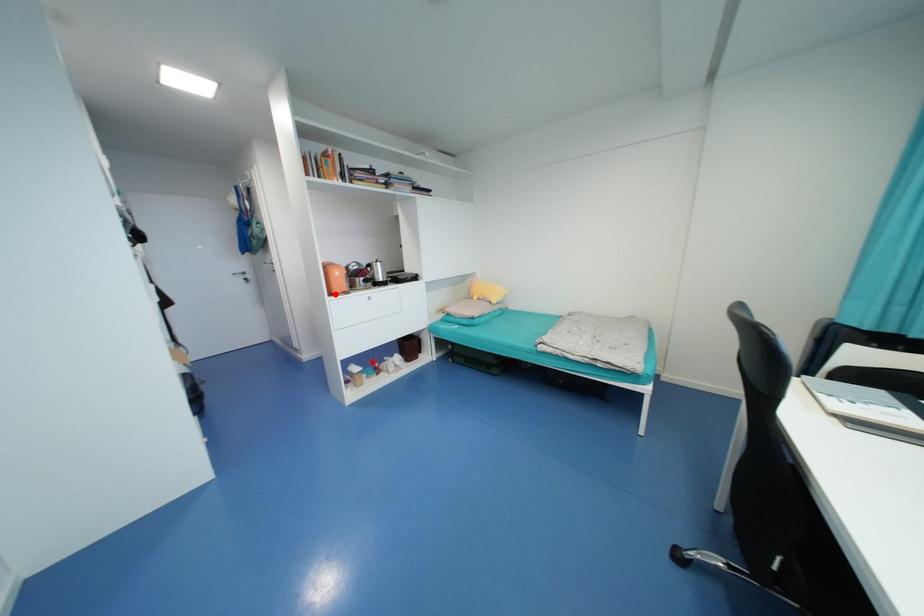
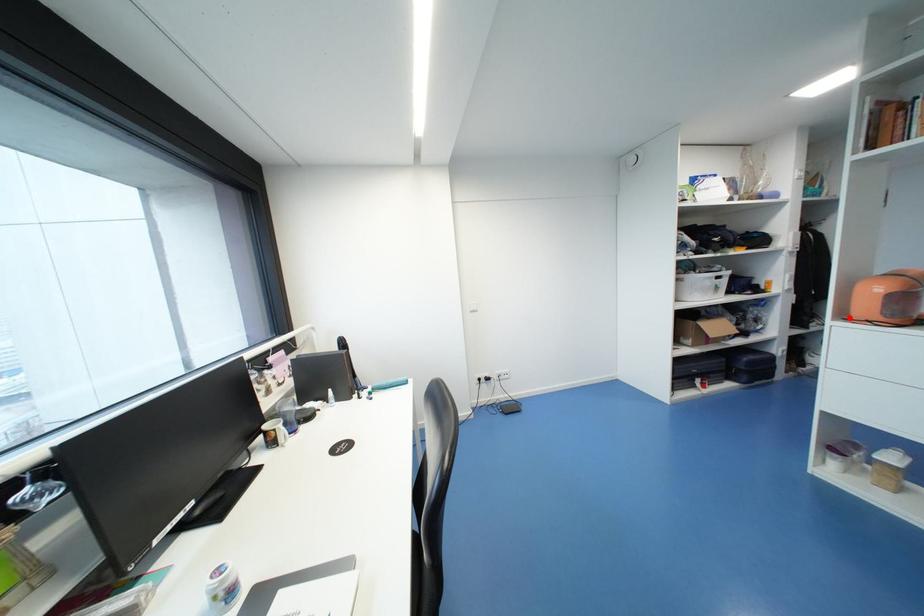
I am providing you with two images of the same scene from different viewpoints. A red point is marked on the first image and another point is marked on the second image. Is the marked point in image1 the same physical position as the marked point in image2?

Yes